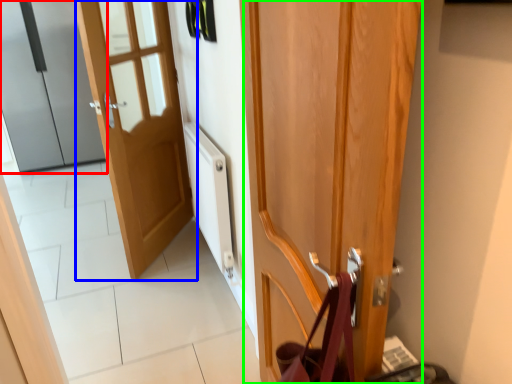
Question: Estimate the real-world distances between objects in this image. Which object is farther from door (highlighted by a red box), door (highlighted by a blue box) or door (highlighted by a green box)?

Choices:
 (A) door
 (B) door

Answer: (B)